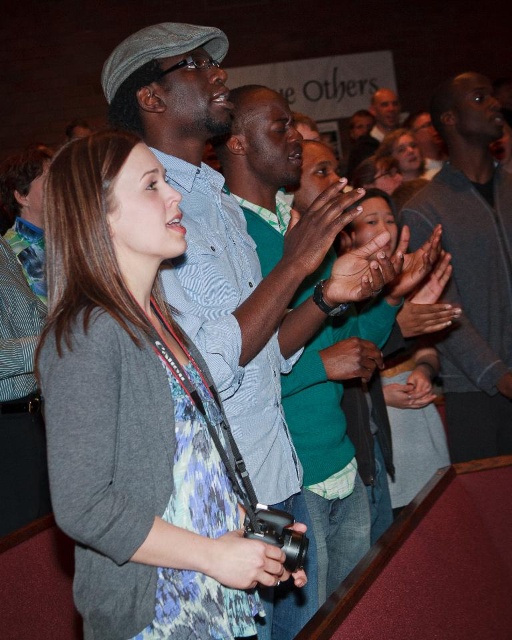
Who is positioned more to the right, blue striped shirt at center or gray sweater at upper right?

gray sweater at upper right is more to the right.

Image resolution: width=512 pixels, height=640 pixels. What are the coordinates of `blue striped shirt at center` in the screenshot? It's located at (217, 244).

Can you confirm if blue striped shirt at center is positioned to the left of green matte shirt at center?

Correct, you'll find blue striped shirt at center to the left of green matte shirt at center.

Describe the element at coordinates (217, 244) in the screenshot. Image resolution: width=512 pixels, height=640 pixels. I see `blue striped shirt at center` at that location.

This screenshot has height=640, width=512. In order to click on blue striped shirt at center in this screenshot , I will do `click(217, 244)`.

Does gray fabric jacket at center have a smaller size compared to green matte shirt at center?

Actually, gray fabric jacket at center might be larger than green matte shirt at center.

Find the location of a particular element. This screenshot has height=640, width=512. gray fabric jacket at center is located at coordinates (x=131, y=406).

Between point (198, 625) and point (358, 352), which one is positioned behind?

Point (358, 352)

Find the location of a particular element. gray fabric jacket at center is located at coordinates (131, 406).